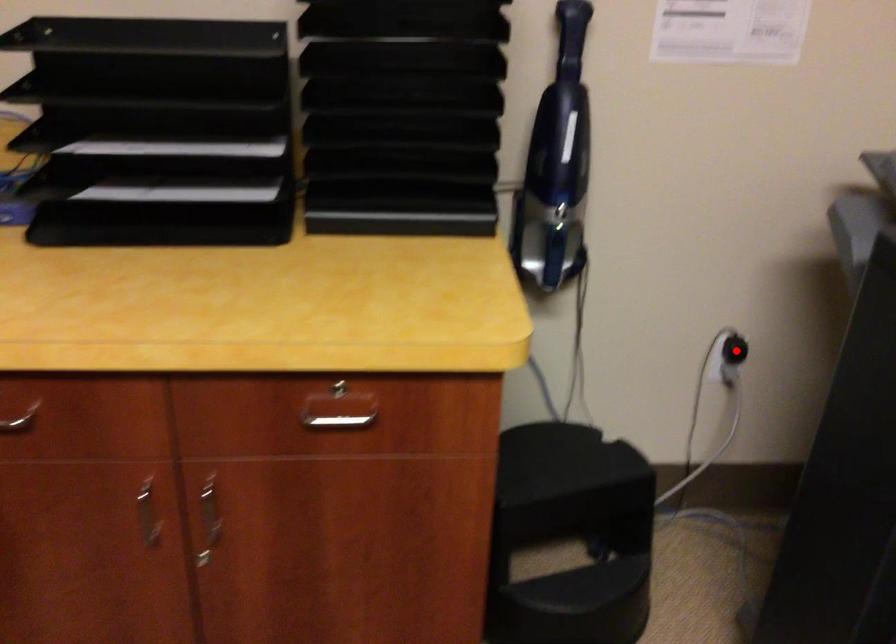
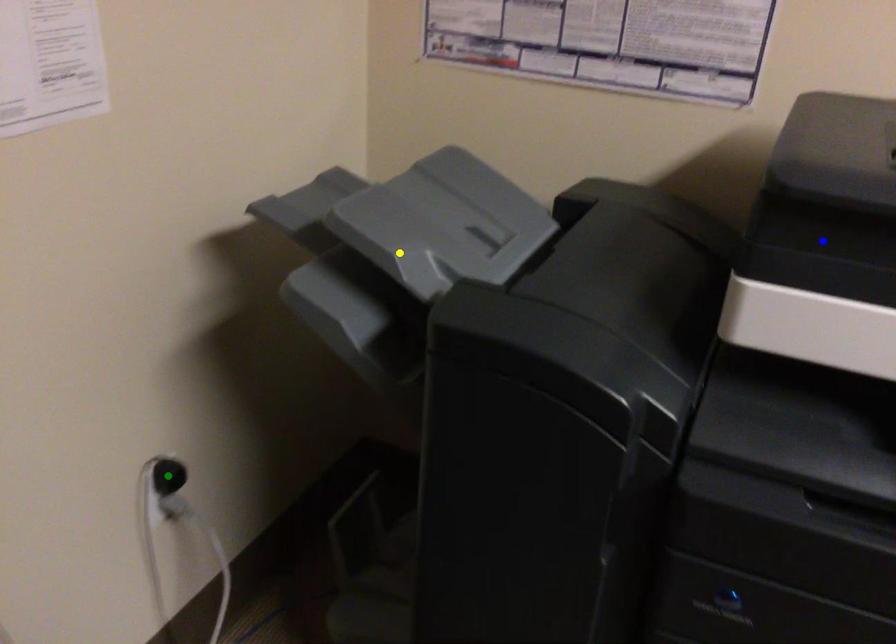
Question: I am providing you with two images of the same scene from different viewpoints. A red point is marked on the first image. You are given multiple points on the second image. Which point in image 2 is actually the same real-world point as the red point in image 1?

Choices:
 (A) blue point
 (B) yellow point
 (C) green point

Answer: (C)